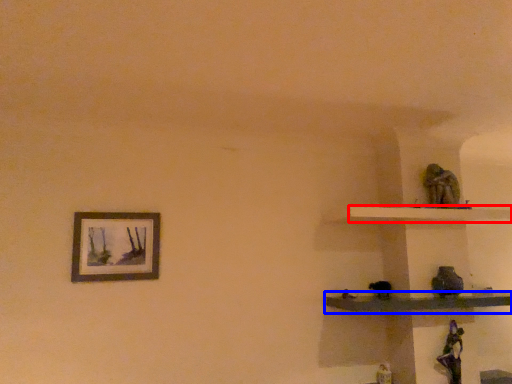
Question: Which point is closer to the camera, shelf (highlighted by a red box) or shelf (highlighted by a blue box)?

Choices:
 (A) shelf
 (B) shelf

Answer: (B)